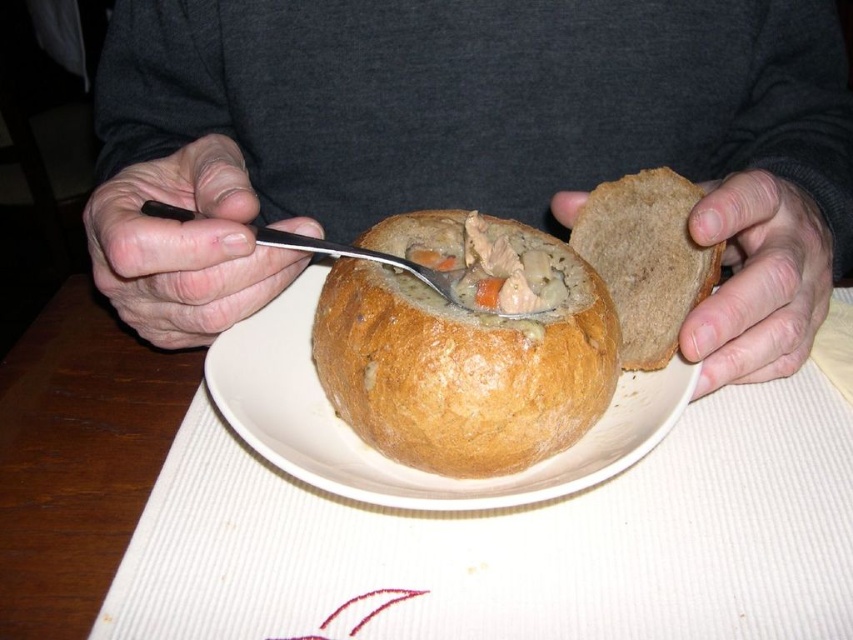
Question: Estimate the real-world distances between objects in this image. Which object is farther from the brown bread at right?

Choices:
 (A) dry skin at left
 (B) brown matte bread at center
 (C) white ceramic plate at center

Answer: (A)

Question: Which of these objects is positioned farthest from the golden brown bread bowl at center?

Choices:
 (A) wooden table at center
 (B) white ceramic plate at center

Answer: (A)

Question: Which point is farther to the camera?

Choices:
 (A) silver metallic fork at center
 (B) brown bread at right
 (C) white ceramic plate at center

Answer: (B)

Question: Is wooden table at center smaller than brown matte bread at center?

Choices:
 (A) no
 (B) yes

Answer: (A)

Question: Can you confirm if golden brown crusty bread bowl at center is smaller than silver metallic fork at center?

Choices:
 (A) no
 (B) yes

Answer: (A)

Question: Does golden brown crusty bread bowl at center appear on the left side of brown matte bread at center?

Choices:
 (A) yes
 (B) no

Answer: (A)